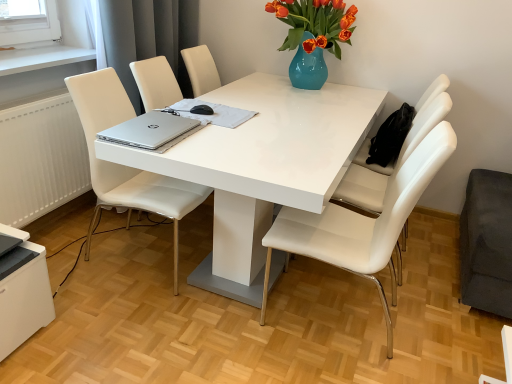
Question: Does white glossy table at center lie behind white leather chair at right, the third chair when ordered from left to right?

Choices:
 (A) yes
 (B) no

Answer: (B)

Question: Is white leather chair at right, acting as the first chair starting from the right, completely or partially inside white glossy table at center?

Choices:
 (A) yes
 (B) no

Answer: (A)

Question: From a real-world perspective, is white glossy table at center below white leather chair at right, the third chair when ordered from left to right?

Choices:
 (A) no
 (B) yes

Answer: (B)

Question: Considering the relative sizes of white glossy table at center and white leather chair at right, the third chair when ordered from left to right, in the image provided, is white glossy table at center smaller than white leather chair at right, the third chair when ordered from left to right,?

Choices:
 (A) no
 (B) yes

Answer: (A)

Question: Is white glossy table at center positioned far away from white leather chair at right, acting as the first chair starting from the right?

Choices:
 (A) no
 (B) yes

Answer: (A)

Question: Which is correct: white glossy table at center is inside white leather chair at center, the third chair viewed from the right, or outside of it?

Choices:
 (A) inside
 (B) outside

Answer: (B)

Question: In terms of size, does white glossy table at center appear bigger or smaller than white leather chair at center, which is the 1th chair from left to right?

Choices:
 (A) small
 (B) big

Answer: (B)

Question: From the image's perspective, is white glossy table at center positioned above or below white leather chair at center, the third chair viewed from the right?

Choices:
 (A) above
 (B) below

Answer: (A)

Question: Considering the positions of white glossy table at center and white leather chair at center, which is the 1th chair from left to right, in the image, is white glossy table at center taller or shorter than white leather chair at center, which is the 1th chair from left to right,?

Choices:
 (A) tall
 (B) short

Answer: (B)

Question: Relative to silver metallic laptop at center, is silver metallic laptop at center in front or behind?

Choices:
 (A) behind
 (B) front

Answer: (B)

Question: Is silver metallic laptop at center to the left or to the right of silver metallic laptop at center in the image?

Choices:
 (A) right
 (B) left

Answer: (B)

Question: From a real-world perspective, is silver metallic laptop at center physically located above or below silver metallic laptop at center?

Choices:
 (A) above
 (B) below

Answer: (A)

Question: Considering the positions of point (118, 130) and point (225, 117), is point (118, 130) closer or farther from the camera than point (225, 117)?

Choices:
 (A) closer
 (B) farther

Answer: (A)

Question: From the image's perspective, is white leather chair at center, which is the 1th chair from left to right, positioned above or below white leather chair at right, the third chair when ordered from left to right?

Choices:
 (A) below
 (B) above

Answer: (A)

Question: Is white leather chair at center, which is the 1th chair from left to right, bigger or smaller than white leather chair at right, acting as the first chair starting from the right?

Choices:
 (A) small
 (B) big

Answer: (A)